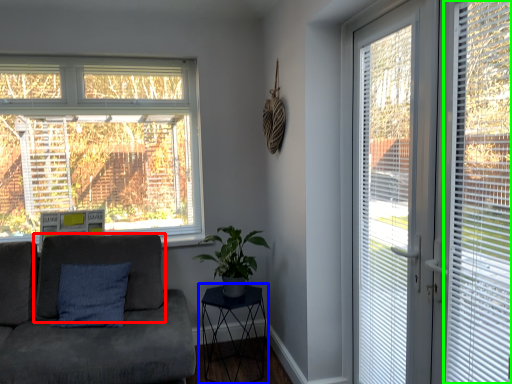
Question: Which is nearer to the swivel chair (highlighted by a red box)? table (highlighted by a blue box) or window blind (highlighted by a green box).

Choices:
 (A) table
 (B) window blind

Answer: (A)